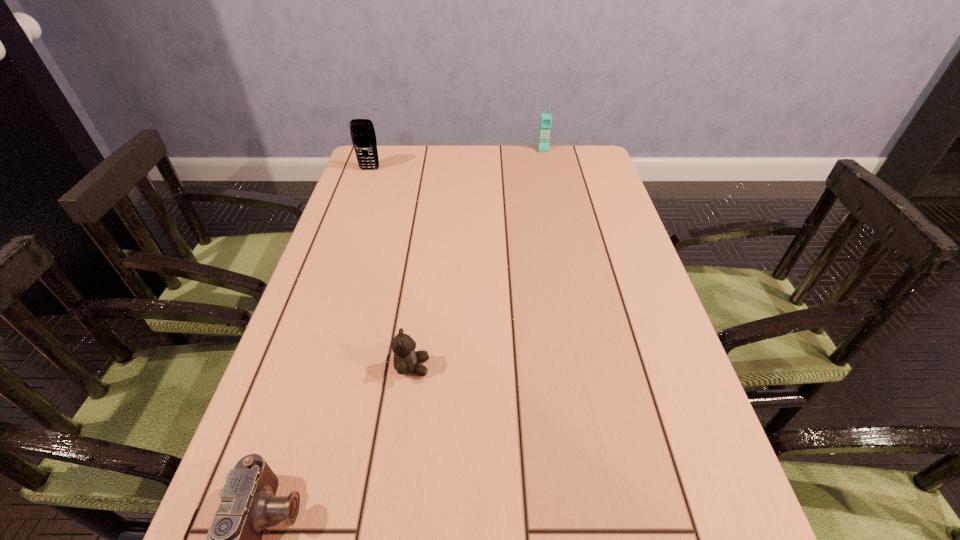
Where is `object present at the far left corner`? object present at the far left corner is located at coordinates (363, 136).

The width and height of the screenshot is (960, 540). I want to click on vacant region at the far edge, so click(x=501, y=157).

This screenshot has height=540, width=960. In order to click on vacant space at the left edge of the desktop in this screenshot , I will do `click(296, 388)`.

Locate an element on the screen. The width and height of the screenshot is (960, 540). free space at the right edge of the desktop is located at coordinates (636, 284).

The width and height of the screenshot is (960, 540). I want to click on vacant position at the far left corner of the desktop, so click(379, 161).

This screenshot has height=540, width=960. I want to click on vacant point located between the third object from left to right and the left cellular telephone, so click(x=391, y=268).

The image size is (960, 540). I want to click on vacant space that's between the teddy bear and the nearer cellular telephone, so coord(391,268).

You are a GUI agent. You are given a task and a screenshot of the screen. Output one action in this format:
    pyautogui.click(x=<x>, y=<y>)
    Task: Click on the empty location between the right cellular telephone and the left cellular telephone
    The height and width of the screenshot is (540, 960).
    Given the screenshot: What is the action you would take?
    pyautogui.click(x=456, y=159)

What are the coordinates of `empty location between the third nearest object and the second object from right to left` in the screenshot? It's located at (391, 268).

Where is `vacant space in between the right cellular telephone and the third nearest object`? vacant space in between the right cellular telephone and the third nearest object is located at coordinates (456, 159).